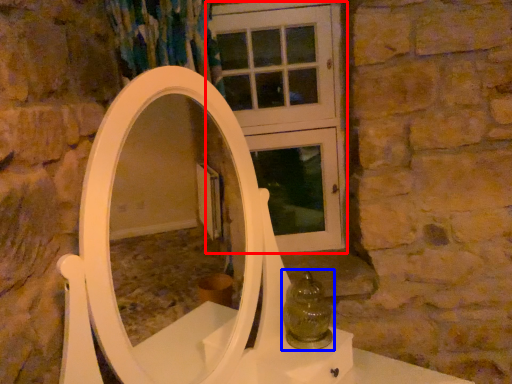
Question: Which of the following is the closest to the observer, screen door (highlighted by a red box) or glass vase (highlighted by a blue box)?

Choices:
 (A) screen door
 (B) glass vase

Answer: (B)